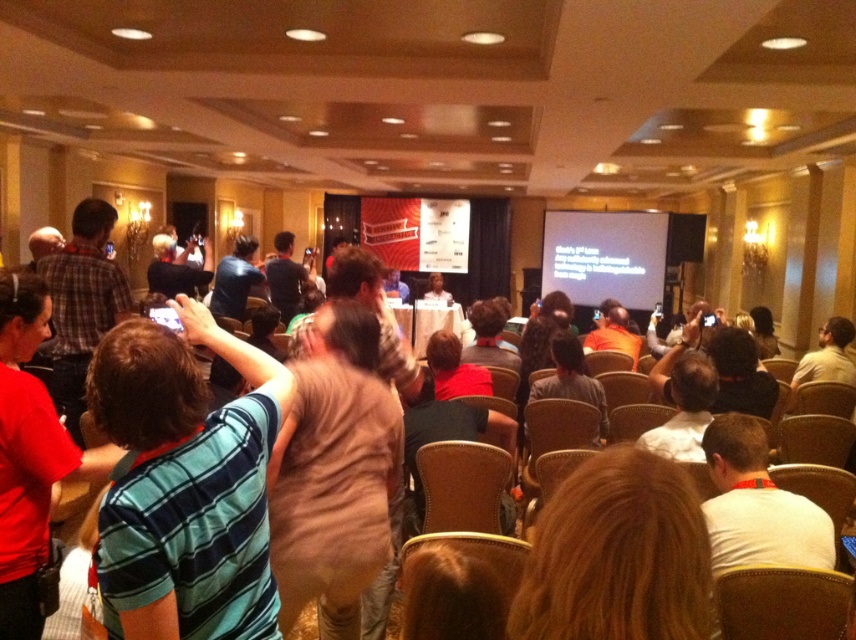
Between point (551, 588) and point (497, 349), which one is positioned in front?

Point (551, 588) is more forward.

Is point (672, 611) farther from camera compared to point (516, 360)?

No.

Describe the element at coordinates (617, 556) in the screenshot. I see `blonde hair at center` at that location.

Image resolution: width=856 pixels, height=640 pixels. Find the location of `blonde hair at center`. blonde hair at center is located at coordinates (617, 556).

Does red shirt at left lie in front of orange shirt at center?

Yes, red shirt at left is closer to the viewer.

In the scene shown: Does red shirt at left have a smaller size compared to orange shirt at center?

Indeed, red shirt at left has a smaller size compared to orange shirt at center.

Which is in front, point (28, 387) or point (607, 349)?

Point (28, 387) is more forward.

Find the location of `red shirt at left`. red shirt at left is located at coordinates (30, 456).

I want to click on matte red shirt at center, so click(455, 369).

Which of these two, matte red shirt at center or fluffy brown teddy bear at center, stands shorter?

matte red shirt at center is shorter.

Does point (462, 392) come in front of point (486, 353)?

Yes, point (462, 392) is closer to viewer.

Where is `matte red shirt at center`? The width and height of the screenshot is (856, 640). matte red shirt at center is located at coordinates (455, 369).